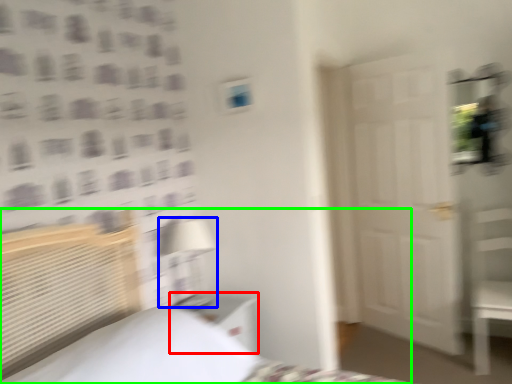
Question: Based on their relative distances, which object is farther from nightstand (highlighted by a red box)? Choose from table lamp (highlighted by a blue box) and bed (highlighted by a green box).

Choices:
 (A) table lamp
 (B) bed

Answer: (B)